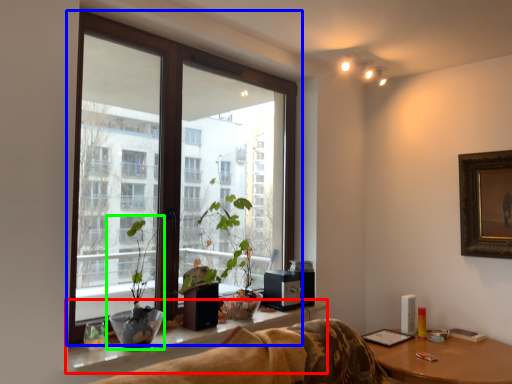
Question: Based on their relative distances, which object is nearer to window sill (highlighted by a red box)? Choose from window (highlighted by a blue box) and houseplant (highlighted by a green box).

Choices:
 (A) window
 (B) houseplant

Answer: (B)